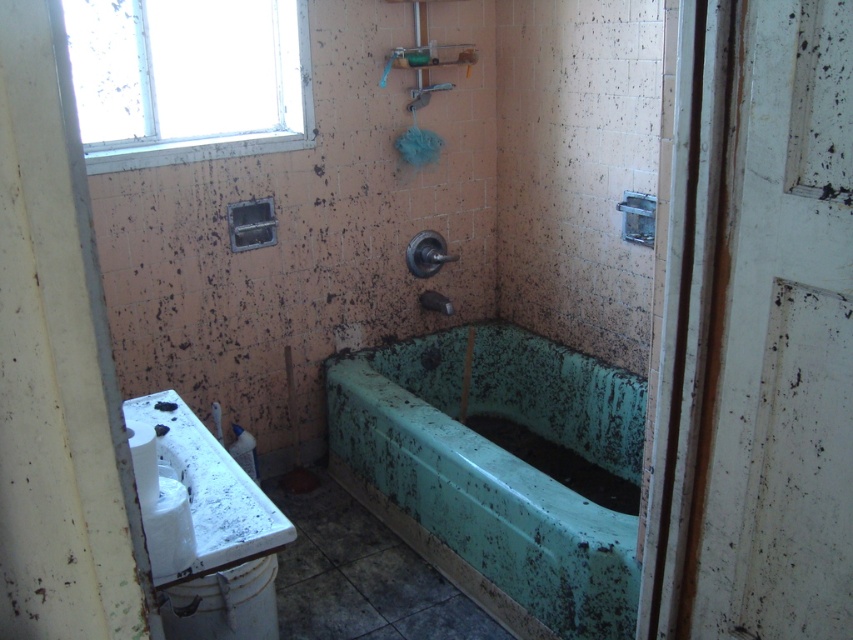
Does point (421, 401) come behind point (244, 637)?

Yes, point (421, 401) is farther from viewer.

Can you confirm if green painted bathtub at center is wider than white glossy toilet bowl at lower left?

Yes.

What are the coordinates of `green painted bathtub at center` in the screenshot? It's located at tap(496, 472).

The width and height of the screenshot is (853, 640). I want to click on green painted bathtub at center, so click(496, 472).

Consider the image. Does green painted bathtub at center have a lesser width compared to white matte sink at lower left?

In fact, green painted bathtub at center might be wider than white matte sink at lower left.

Can you confirm if green painted bathtub at center is smaller than white matte sink at lower left?

No, green painted bathtub at center is not smaller than white matte sink at lower left.

Between point (363, 358) and point (196, 532), which one is positioned in front?

Positioned in front is point (196, 532).

This screenshot has height=640, width=853. Identify the location of green painted bathtub at center. (496, 472).

What do you see at coordinates (215, 531) in the screenshot?
I see `white matte sink at lower left` at bounding box center [215, 531].

Locate an element on the screen. The height and width of the screenshot is (640, 853). white matte sink at lower left is located at coordinates (215, 531).